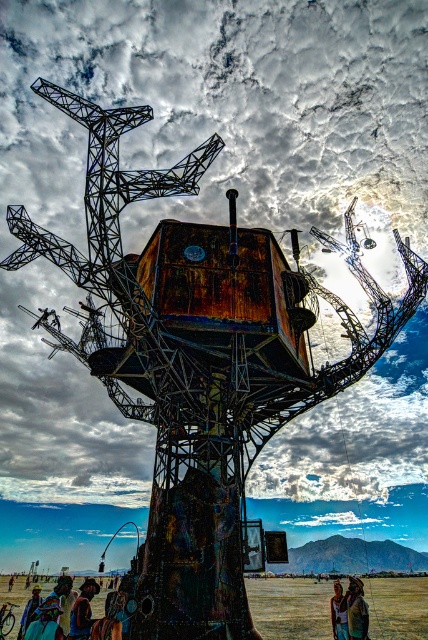
Question: Does brown leather jacket at lower right lie in front of multicolored fabric at center?

Choices:
 (A) yes
 (B) no

Answer: (B)

Question: Which point is closer to the camera?

Choices:
 (A) (338, 596)
 (B) (67, 627)
 (C) (79, 595)

Answer: (B)

Question: Which of the following is the farthest from the observer?

Choices:
 (A) (27, 600)
 (B) (303, 624)
 (C) (9, 577)
 (D) (88, 637)

Answer: (C)

Question: From the image, what is the correct spatial relationship of brown dirt field at lower center in relation to brown leather jacket at lower right?

Choices:
 (A) below
 (B) above

Answer: (B)

Question: Among these objects, which one is farthest from the camera?

Choices:
 (A) multicolored fabric at center
 (B) blue fabric person at lower left
 (C) brown dirt field at lower center

Answer: (C)

Question: Can you confirm if dark brown leather jacket at lower left is smaller than yellowish skin tone at lower center?

Choices:
 (A) no
 (B) yes

Answer: (A)